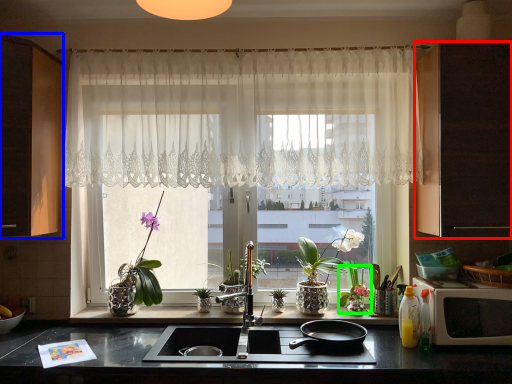
Question: Which object is the farthest from cabinetry (highlighted by a red box)? Choose among these: cabinetry (highlighted by a blue box) or floral arrangement (highlighted by a green box).

Choices:
 (A) cabinetry
 (B) floral arrangement

Answer: (A)